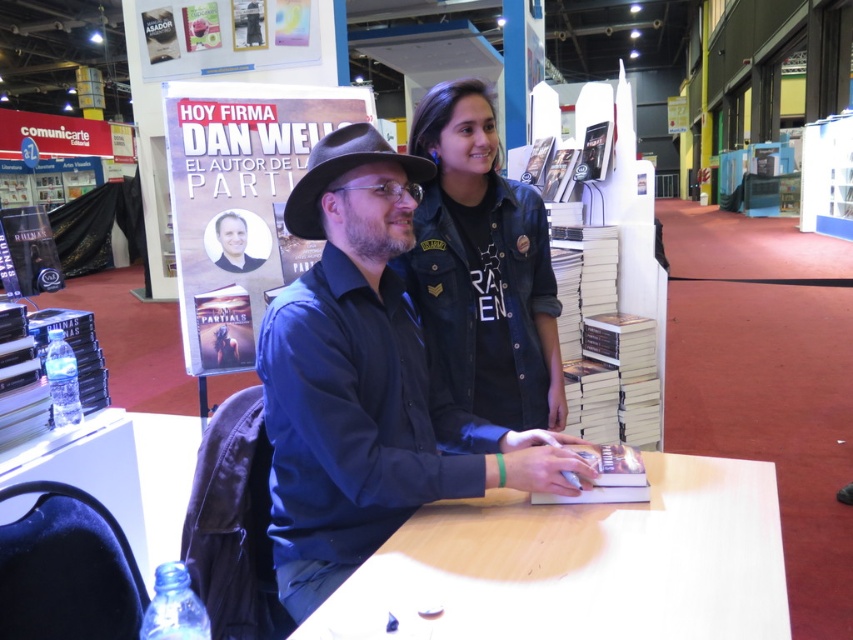
Describe the element at coordinates (49, 374) in the screenshot. This screenshot has width=853, height=640. I see `clear plastic water bottle at lower left` at that location.

The image size is (853, 640). What do you see at coordinates (49, 374) in the screenshot?
I see `clear plastic water bottle at lower left` at bounding box center [49, 374].

You are a GUI agent. You are given a task and a screenshot of the screen. Output one action in this format:
    pyautogui.click(x=<x>, y=<y>)
    Task: Click on the clear plastic water bottle at lower left
    
    Given the screenshot: What is the action you would take?
    pyautogui.click(x=49, y=374)

Does light wood table at center appear on the right side of clear plastic water bottle at lower left?

Correct, you'll find light wood table at center to the right of clear plastic water bottle at lower left.

Which is behind, point (469, 541) or point (7, 440)?

The point (7, 440) is more distant.

The height and width of the screenshot is (640, 853). Identify the location of light wood table at center. (581, 564).

Which is behind, point (480, 456) or point (70, 333)?

Positioned behind is point (70, 333).

Does blue shirt at center have a lesser height compared to clear plastic water bottle at lower left?

No, blue shirt at center is not shorter than clear plastic water bottle at lower left.

Find the location of a particular element. blue shirt at center is located at coordinates (367, 381).